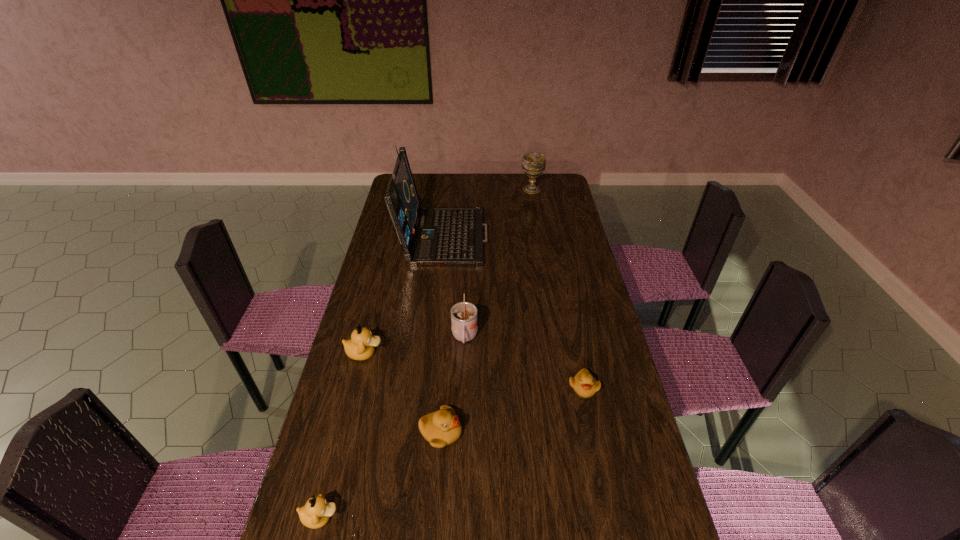
The image size is (960, 540). What are the coordinates of `object positioned at the far edge` in the screenshot? It's located at (534, 163).

Where is `laptop computer that is at the left edge`? This screenshot has height=540, width=960. laptop computer that is at the left edge is located at coordinates (429, 236).

The width and height of the screenshot is (960, 540). Identify the location of chalice positioned at the right edge. (534, 163).

Identify the location of duckling at the right edge. [584, 384].

Locate an element on the screen. This screenshot has width=960, height=540. object located at the far right corner is located at coordinates (534, 163).

The image size is (960, 540). In the image, there is a desktop. In order to click on vacant space at the far edge in this screenshot , I will do coord(452,191).

Where is `vacant region at the left edge`? vacant region at the left edge is located at coordinates (391, 352).

Locate an element on the screen. free space at the right edge is located at coordinates (569, 363).

Where is `free space between the cup and the third nearest object`? free space between the cup and the third nearest object is located at coordinates (524, 362).

Where is `vacant area that lies between the fourth shortest object and the tallest object`? This screenshot has width=960, height=540. vacant area that lies between the fourth shortest object and the tallest object is located at coordinates (404, 293).